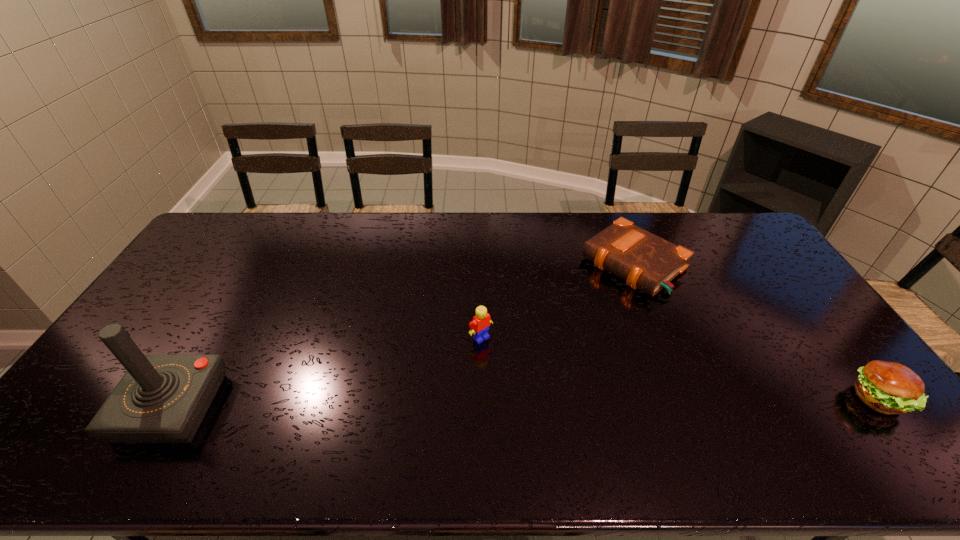
Identify the location of vacant space on the desktop that is between the leftmost object and the second shortest object and is positioned on the front-facing side of the third object from right to left. (545, 403).

In order to click on free spot on the desktop that is between the tallest object and the second shortest object and is positioned on the spine side of the shortest object in this screenshot , I will do `click(450, 404)`.